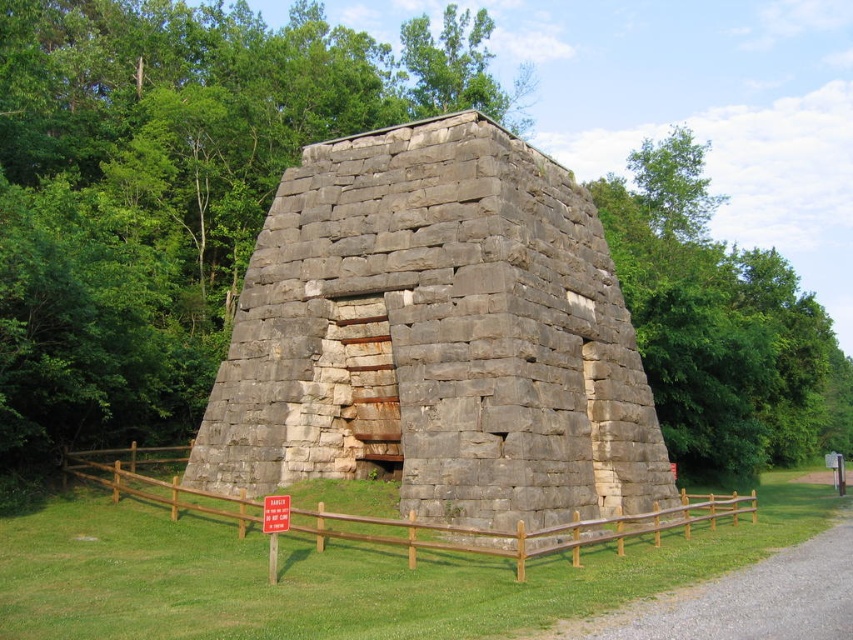
Question: Which object is positioned closest to the gray stone structure at center?

Choices:
 (A) green leafy tree at upper center
 (B) brown wooden fence at center
 (C) red plastic sign at center
 (D) green leafy tree at center

Answer: (B)

Question: Is brown wooden fence at center thinner than red plastic sign at center?

Choices:
 (A) no
 (B) yes

Answer: (A)

Question: Can you confirm if brown wooden fence at center is wider than red plastic sign at center?

Choices:
 (A) yes
 (B) no

Answer: (A)

Question: Does green leafy tree at upper center appear on the left side of brown wooden fence at center?

Choices:
 (A) no
 (B) yes

Answer: (A)

Question: Which object is positioned farthest from the red plastic sign at center?

Choices:
 (A) gray stone structure at center
 (B) green leafy tree at upper center
 (C) green leafy tree at center
 (D) brown wooden fence at center

Answer: (B)

Question: Which object appears farthest from the camera in this image?

Choices:
 (A) gray stone structure at center
 (B) green leafy tree at upper center
 (C) green leafy tree at center
 (D) brown wooden fence at center

Answer: (B)